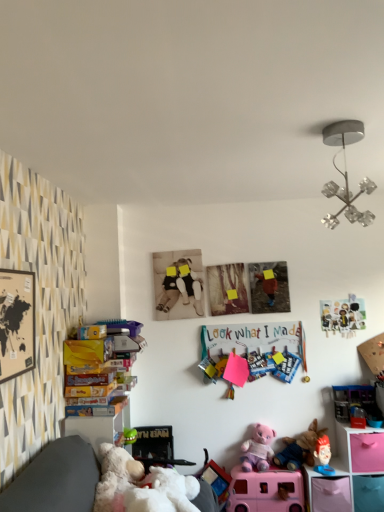
Question: From the image's perspective, is purple plush bear at center, the 5th toy positioned from the top, beneath black matte picture frame at left?

Choices:
 (A) no
 (B) yes

Answer: (B)

Question: Does purple plush bear at center, the 5th toy positioned from the top, have a greater height compared to black matte picture frame at left?

Choices:
 (A) no
 (B) yes

Answer: (A)

Question: Would you say purple plush bear at center, the 5th toy positioned from the top, is outside black matte picture frame at left?

Choices:
 (A) yes
 (B) no

Answer: (A)

Question: Does purple plush bear at center, the 5th toy positioned from the top, have a greater width compared to black matte picture frame at left?

Choices:
 (A) no
 (B) yes

Answer: (B)

Question: Is purple plush bear at center, the 5th toy positioned from the top, at the left side of black matte picture frame at left?

Choices:
 (A) yes
 (B) no

Answer: (B)

Question: Can you confirm if purple plush bear at center, placed as the 2th toy when sorted from bottom to top, is positioned to the right of black matte picture frame at left?

Choices:
 (A) no
 (B) yes

Answer: (B)

Question: Is pink plastic shelf at lower right, the second shelf in the top-to-bottom sequence, oriented away from plush fabric toy at lower right, which ranks as the third toy in bottom-to-top order?

Choices:
 (A) no
 (B) yes

Answer: (A)

Question: Is pink plastic shelf at lower right, the second shelf in the top-to-bottom sequence, positioned behind plush fabric toy at lower right, which ranks as the third toy in bottom-to-top order?

Choices:
 (A) yes
 (B) no

Answer: (B)

Question: Can you confirm if pink plastic shelf at lower right, which is the 1th shelf in bottom-to-top order, is wider than plush fabric toy at lower right, which is the 4th toy from top to bottom?

Choices:
 (A) yes
 (B) no

Answer: (A)

Question: Does pink plastic shelf at lower right, which is the 1th shelf in bottom-to-top order, appear on the left side of plush fabric toy at lower right, which is the 4th toy from top to bottom?

Choices:
 (A) yes
 (B) no

Answer: (B)

Question: Can we say pink plastic shelf at lower right, which is the 1th shelf in bottom-to-top order, lies outside plush fabric toy at lower right, which is the 4th toy from top to bottom?

Choices:
 (A) no
 (B) yes

Answer: (B)

Question: From the image's perspective, is pink plastic shelf at lower right, which is the 1th shelf in bottom-to-top order, located above plush fabric toy at lower right, which ranks as the third toy in bottom-to-top order?

Choices:
 (A) yes
 (B) no

Answer: (B)

Question: Is multicolored paper clips at center oriented towards metallic silver chandelier at upper right?

Choices:
 (A) yes
 (B) no

Answer: (B)